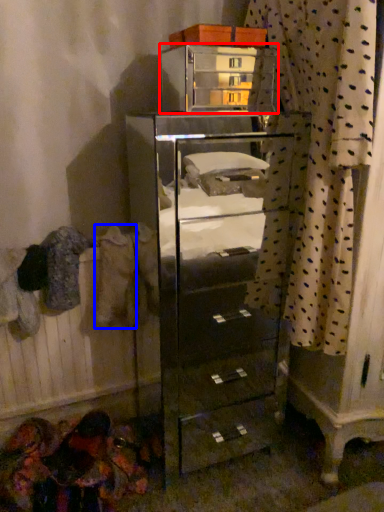
Question: Which object is closer to the camera taking this photo, furniture (highlighted by a red box) or clothing (highlighted by a blue box)?

Choices:
 (A) furniture
 (B) clothing

Answer: (A)